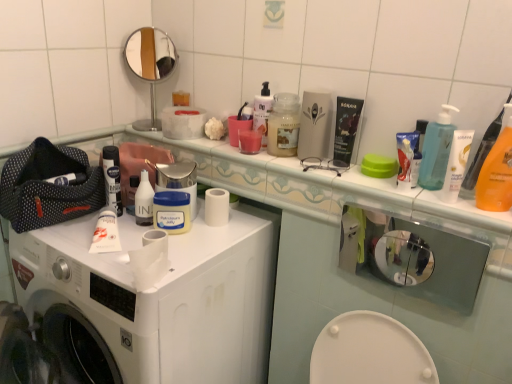
Where is `free space to the left of white matte jar at center, which is counted as the second mouthwash, starting from the left`? This screenshot has width=512, height=384. free space to the left of white matte jar at center, which is counted as the second mouthwash, starting from the left is located at coordinates (88, 236).